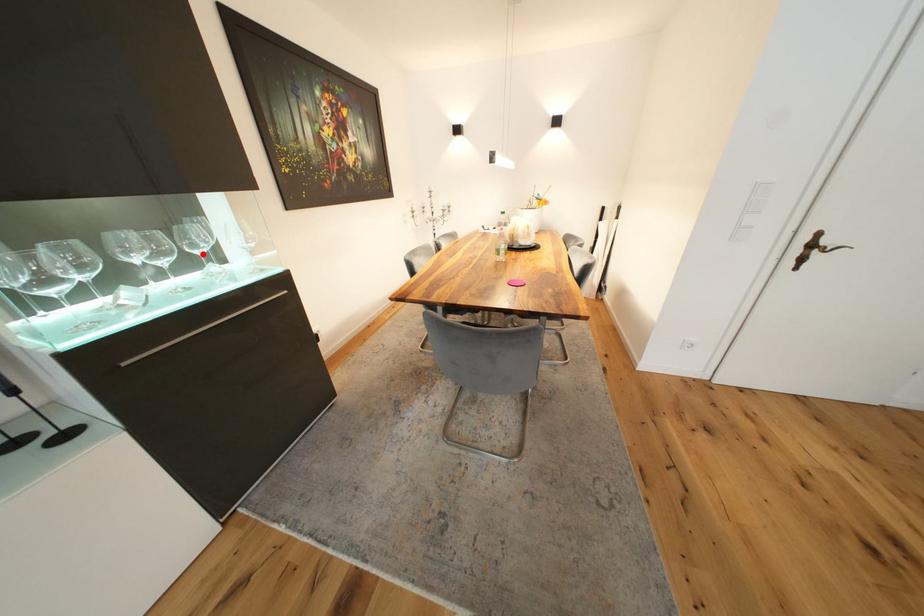
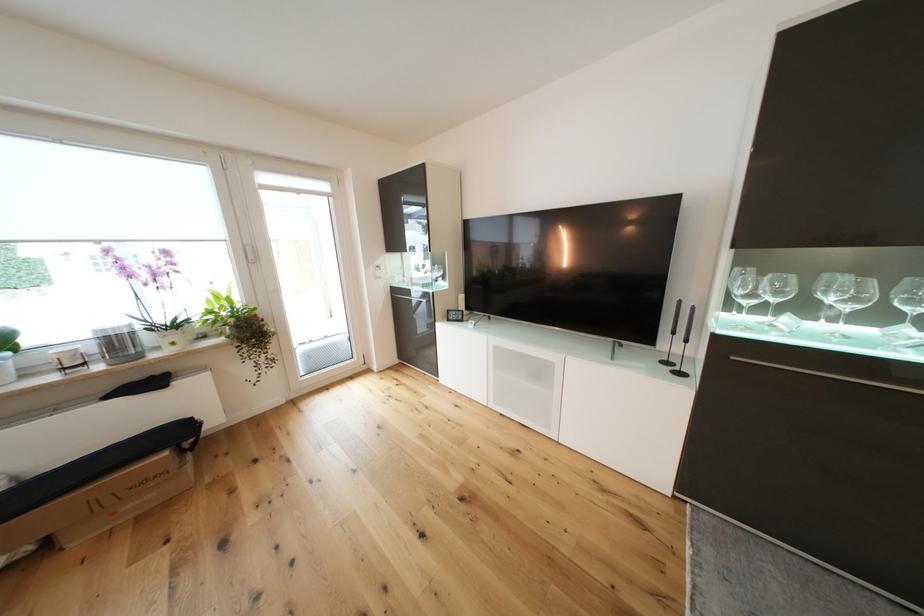
The point at the highlighted location is marked in the first image. Where is the corresponding point in the second image?

(913, 310)